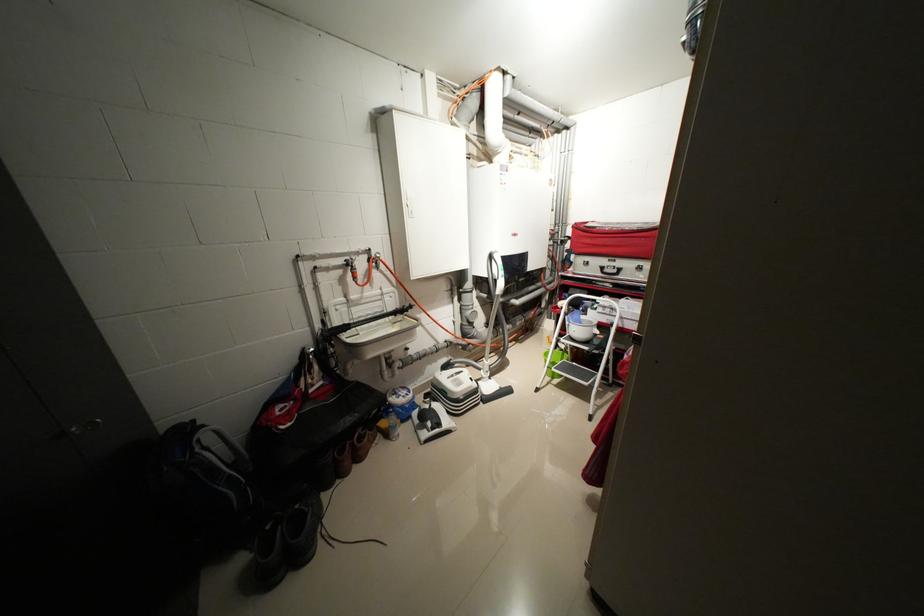
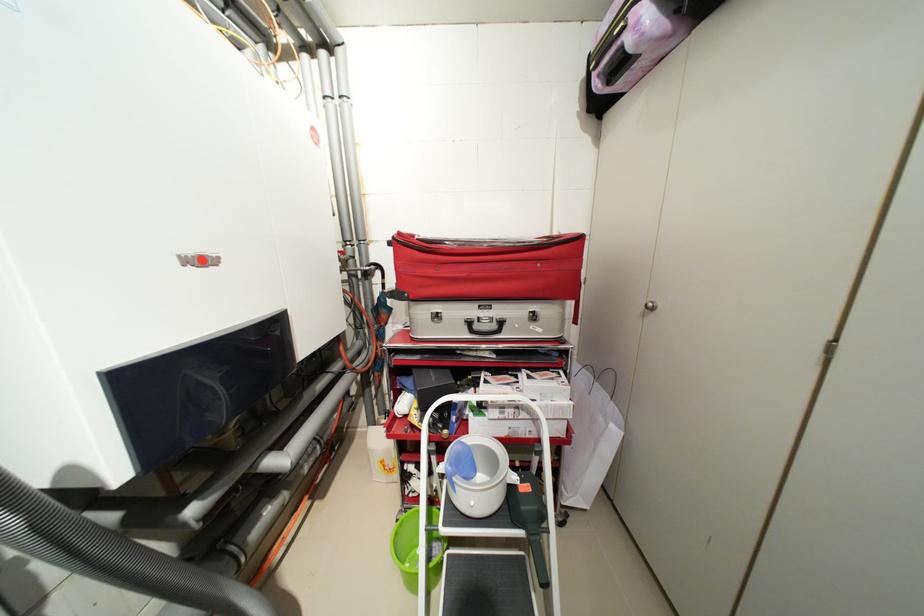
Locate, in the second image, the point that corresponds to the point at 623,272 in the first image.

(502, 326)